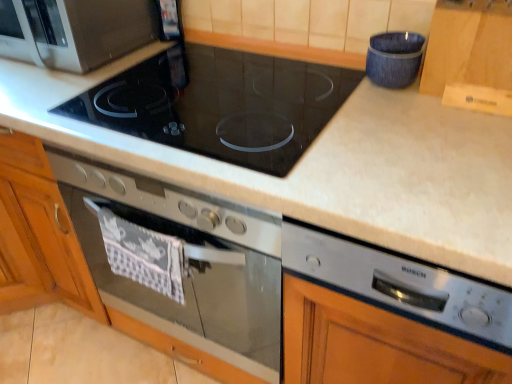
Locate an element on the screen. This screenshot has height=384, width=512. free space between matte black microwave at upper left and blue textured fabric at upper right, positioned as the second appliance in bottom-to-top order is located at coordinates (199, 66).